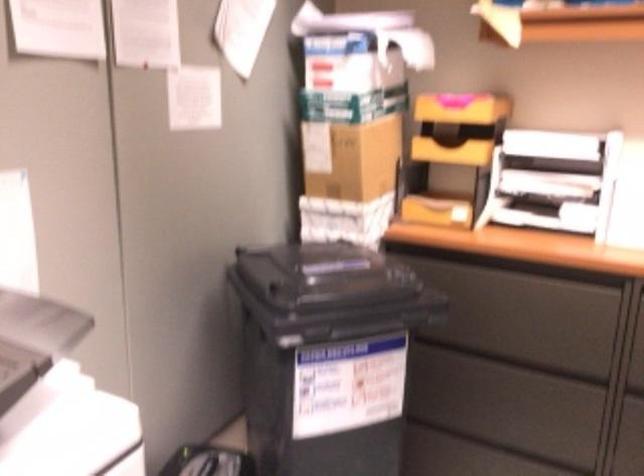
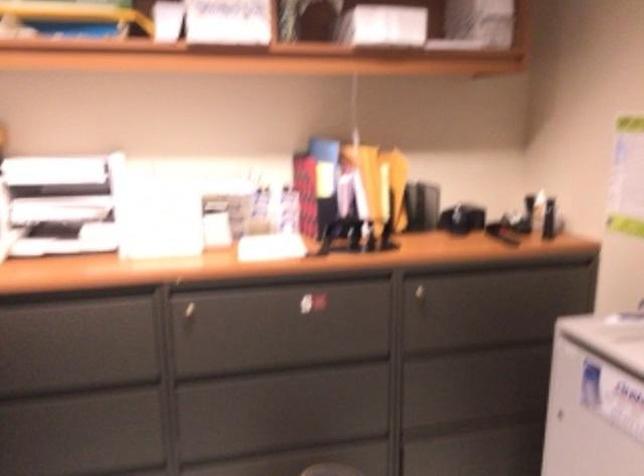
Locate, in the second image, the point that corresponds to pixel 527 308 in the first image.

(70, 336)